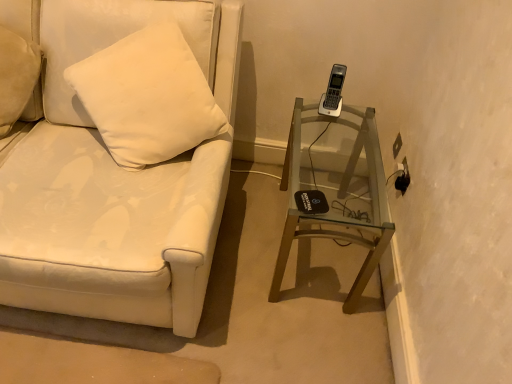
Question: From a real-world perspective, is white leather couch at left physically located above or below transparent glass table at lower right?

Choices:
 (A) above
 (B) below

Answer: (A)

Question: Based on their sizes in the image, would you say white leather couch at left is bigger or smaller than transparent glass table at lower right?

Choices:
 (A) big
 (B) small

Answer: (A)

Question: Considering the positions of point (4, 182) and point (354, 302), is point (4, 182) closer or farther from the camera than point (354, 302)?

Choices:
 (A) closer
 (B) farther

Answer: (A)

Question: In the image, is transparent glass table at lower right on the left side or the right side of white leather couch at left?

Choices:
 (A) left
 (B) right

Answer: (B)

Question: Is transparent glass table at lower right wider or thinner than white leather couch at left?

Choices:
 (A) thin
 (B) wide

Answer: (A)

Question: Considering the positions of point (297, 238) and point (143, 271), is point (297, 238) closer or farther from the camera than point (143, 271)?

Choices:
 (A) farther
 (B) closer

Answer: (A)

Question: Is transparent glass table at lower right inside the boundaries of white leather couch at left, or outside?

Choices:
 (A) outside
 (B) inside

Answer: (A)